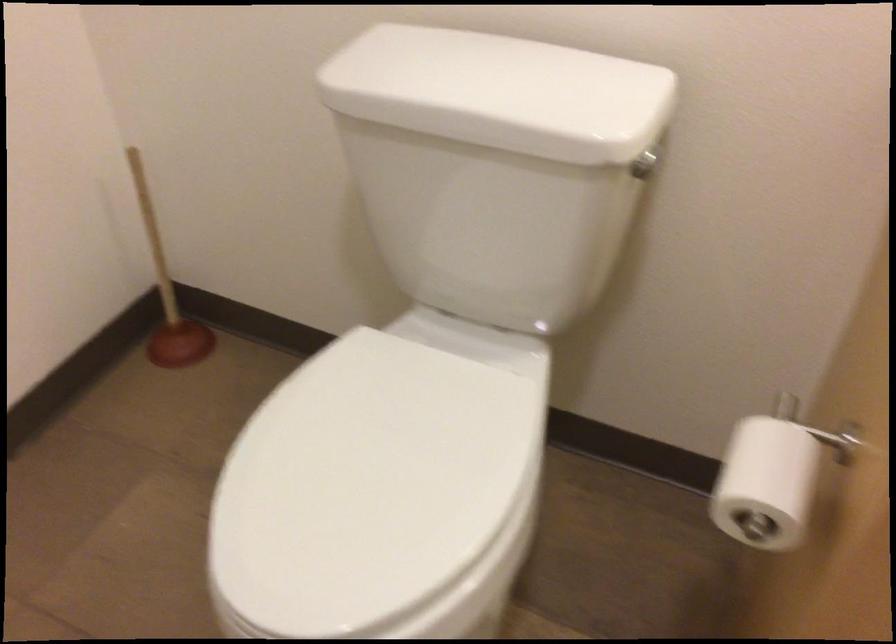
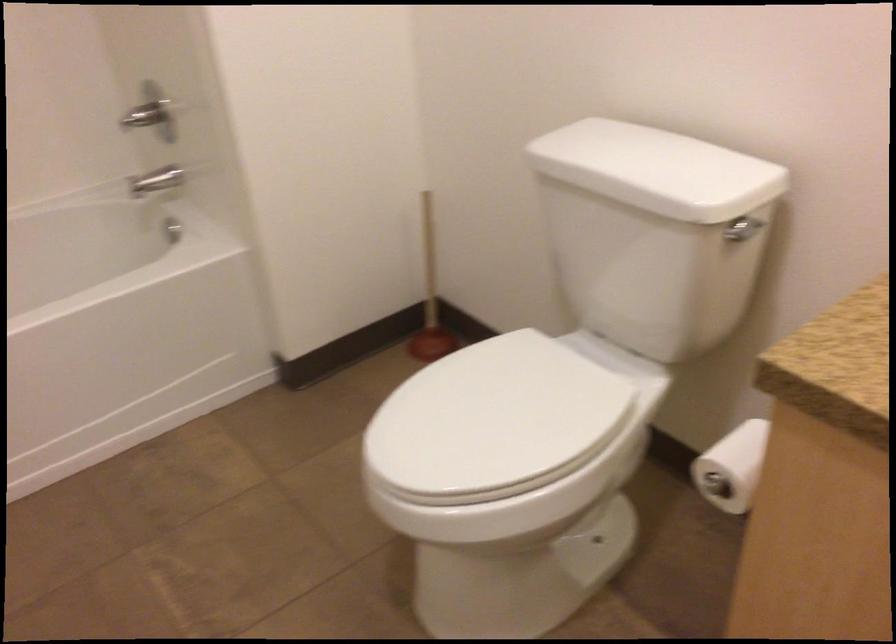
Question: The camera is either moving clockwise (left) or counter-clockwise (right) around the object. The first image is from the beginning of the video and the second image is from the end. Is the camera moving left or right when shooting the video?

Choices:
 (A) Left
 (B) Right

Answer: (B)